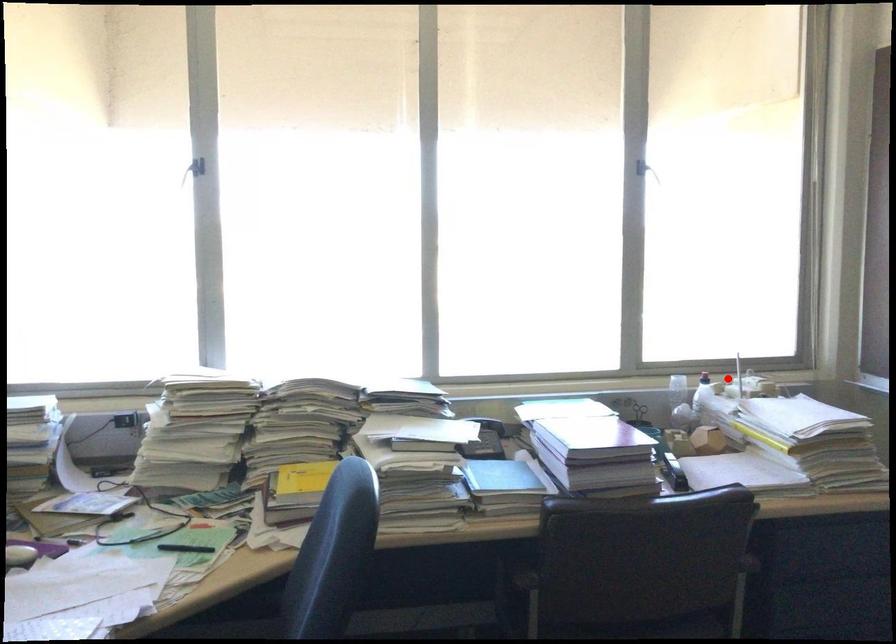
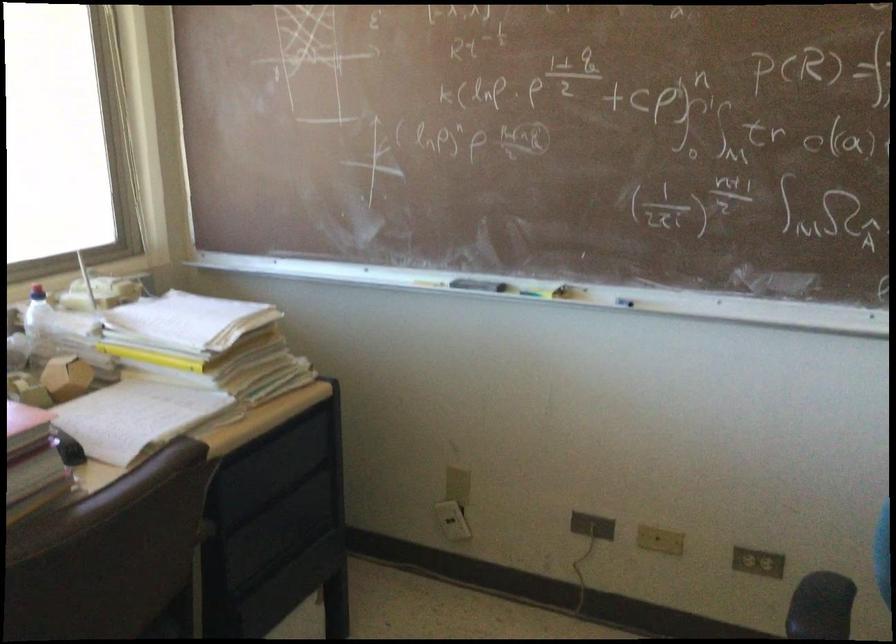
Question: I am providing you with two images of the same scene from different viewpoints. Image1 has a red point marked. In image2, the corresponding 3D location appears at what relative position? Reply with the corresponding letter.

Choices:
 (A) Closer
 (B) Farther

Answer: (A)